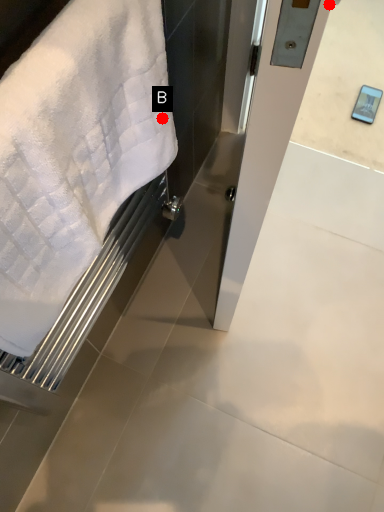
Question: Two points are circled on the image, labeled by A and B beside each circle. Which point is further to the camera?

Choices:
 (A) A is further
 (B) B is further

Answer: (A)